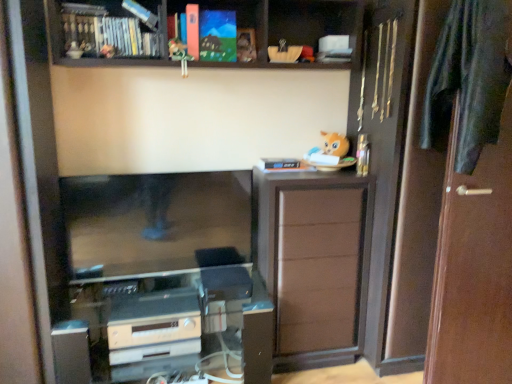
Question: From a real-world perspective, does matte black book at upper left, arranged as the first book when viewed from the left, stand above matte black tv at center?

Choices:
 (A) no
 (B) yes

Answer: (B)

Question: Is matte black book at upper left, the 2th book from the right, shorter than matte black tv at center?

Choices:
 (A) no
 (B) yes

Answer: (B)

Question: Can matte black tv at center be found inside matte black book at upper left, the 2th book from the right?

Choices:
 (A) yes
 (B) no

Answer: (B)

Question: Can you confirm if matte black book at upper left, arranged as the first book when viewed from the left, is positioned to the right of matte black tv at center?

Choices:
 (A) no
 (B) yes

Answer: (A)

Question: Is matte black book at upper left, arranged as the first book when viewed from the left, with matte black tv at center?

Choices:
 (A) yes
 (B) no

Answer: (B)

Question: Does matte black book at upper left, the 2th book from the right, appear on the left side of matte black tv at center?

Choices:
 (A) no
 (B) yes

Answer: (B)

Question: From a real-world perspective, is matte acrylic painting at upper center, which ranks as the 1th book in right-to-left order, physically below satin silver appliance at lower center?

Choices:
 (A) yes
 (B) no

Answer: (B)

Question: Is matte acrylic painting at upper center, the 2th book when ordered from left to right, smaller than satin silver appliance at lower center?

Choices:
 (A) yes
 (B) no

Answer: (A)

Question: Does matte acrylic painting at upper center, which ranks as the 1th book in right-to-left order, have a lesser height compared to satin silver appliance at lower center?

Choices:
 (A) yes
 (B) no

Answer: (B)

Question: Is matte acrylic painting at upper center, which ranks as the 1th book in right-to-left order, at the left side of satin silver appliance at lower center?

Choices:
 (A) yes
 (B) no

Answer: (B)

Question: Is matte acrylic painting at upper center, the 2th book when ordered from left to right, facing away from satin silver appliance at lower center?

Choices:
 (A) no
 (B) yes

Answer: (A)

Question: Is matte acrylic painting at upper center, which ranks as the 1th book in right-to-left order, to the right of satin silver appliance at lower center from the viewer's perspective?

Choices:
 (A) yes
 (B) no

Answer: (A)

Question: From a real-world perspective, does dark green fabric at right sit lower than satin silver appliance at lower center?

Choices:
 (A) yes
 (B) no

Answer: (B)